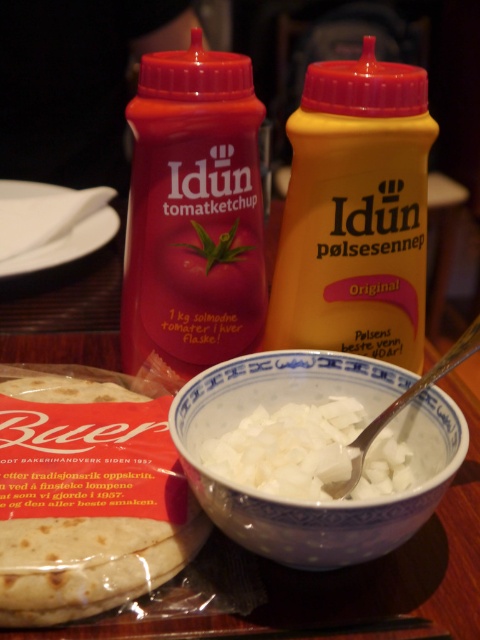
You are a chef standing at the table where the golden brown flatbread at lower left is placed. You need to grab the flatbread but have a 30 cm long spatula. Can you reach it without moving closer?

The golden brown flatbread at lower left is 32.42 centimeters away from the viewer. Since the spatula is only 30 cm long, you cannot reach it without moving closer.

You are setting up a buffet table and need to arrange items based on their sizes. You have a white creamy bowl at center and a matte plastic bottle at upper left. Which item should you place first if you want to start with the wider object?

The matte plastic bottle at upper left is wider than the white creamy bowl at center, so you should place the matte plastic bottle at upper left first.